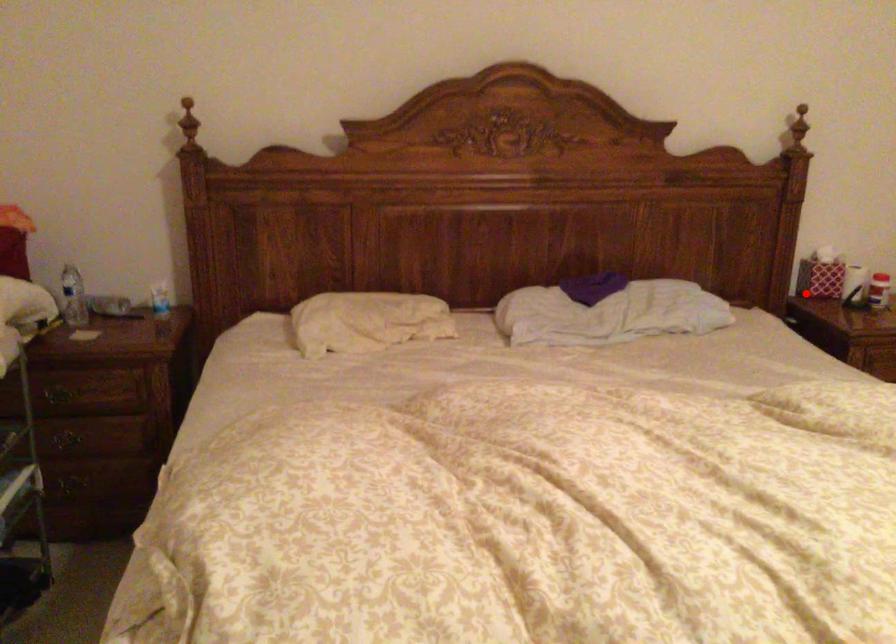
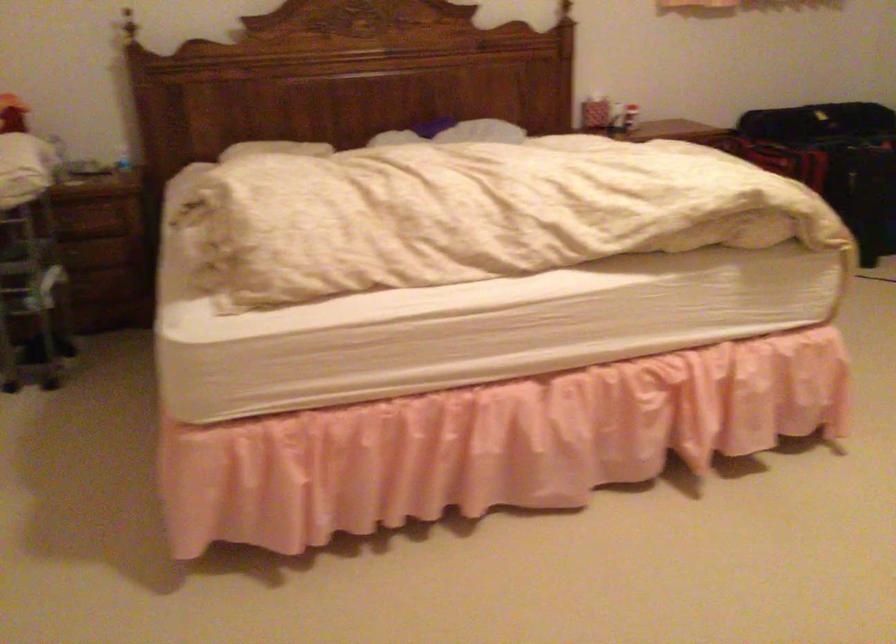
The point at the highlighted location is marked in the first image. Where is the corresponding point in the second image?

(590, 109)